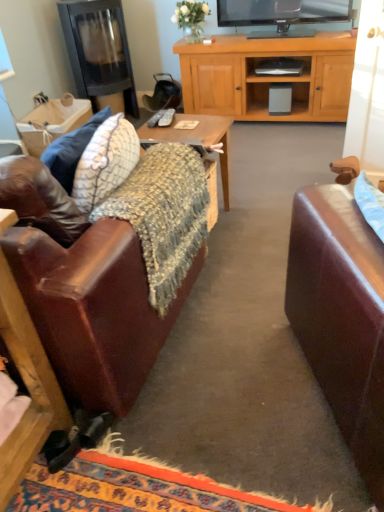
Question: Is black glass fireplace at upper left to the left of leather couch at left from the viewer's perspective?

Choices:
 (A) yes
 (B) no

Answer: (A)

Question: Is black glass fireplace at upper left aimed at leather couch at left?

Choices:
 (A) no
 (B) yes

Answer: (B)

Question: Are black glass fireplace at upper left and leather couch at left far apart?

Choices:
 (A) no
 (B) yes

Answer: (B)

Question: Is black glass fireplace at upper left looking in the opposite direction of leather couch at left?

Choices:
 (A) no
 (B) yes

Answer: (A)

Question: Is black glass fireplace at upper left completely or partially outside of leather couch at left?

Choices:
 (A) no
 (B) yes

Answer: (B)

Question: Considering the positions of knitted fabric desk at center and natural woven picnic basket at upper left in the image, is knitted fabric desk at center taller or shorter than natural woven picnic basket at upper left?

Choices:
 (A) short
 (B) tall

Answer: (A)

Question: Is point (158, 138) positioned closer to the camera than point (87, 115)?

Choices:
 (A) farther
 (B) closer

Answer: (B)

Question: Is knitted fabric desk at center in front of or behind natural woven picnic basket at upper left in the image?

Choices:
 (A) front
 (B) behind

Answer: (A)

Question: Would you say knitted fabric desk at center is inside or outside natural woven picnic basket at upper left?

Choices:
 (A) inside
 (B) outside

Answer: (B)

Question: Is natural woven picnic basket at upper left inside the boundaries of leather couch at left, or outside?

Choices:
 (A) inside
 (B) outside

Answer: (B)

Question: Would you say natural woven picnic basket at upper left is to the left or to the right of leather couch at left in the picture?

Choices:
 (A) left
 (B) right

Answer: (A)

Question: Is natural woven picnic basket at upper left bigger or smaller than leather couch at left?

Choices:
 (A) big
 (B) small

Answer: (B)

Question: Is natural woven picnic basket at upper left taller or shorter than leather couch at left?

Choices:
 (A) short
 (B) tall

Answer: (A)

Question: Would you say matte gray remote control at center, marked as the 2th remote control in a left-to-right arrangement, is inside or outside natural woven picnic basket at upper left?

Choices:
 (A) inside
 (B) outside

Answer: (B)

Question: Considering the positions of matte gray remote control at center, marked as the first remote control in a right-to-left arrangement, and natural woven picnic basket at upper left in the image, is matte gray remote control at center, marked as the first remote control in a right-to-left arrangement, bigger or smaller than natural woven picnic basket at upper left?

Choices:
 (A) small
 (B) big

Answer: (A)